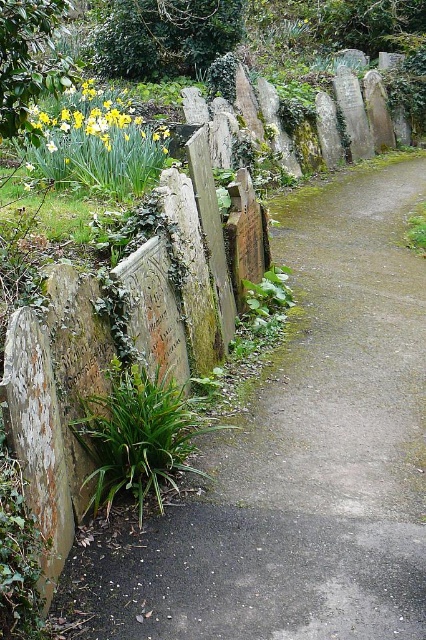
Does point (299, 566) lie behind point (49, 129)?

No, (299, 566) is in front of (49, 129).

Is smooth stone path at center wider than yellow matte daffodil at upper left?

In fact, smooth stone path at center might be narrower than yellow matte daffodil at upper left.

The height and width of the screenshot is (640, 426). I want to click on smooth stone path at center, so click(299, 456).